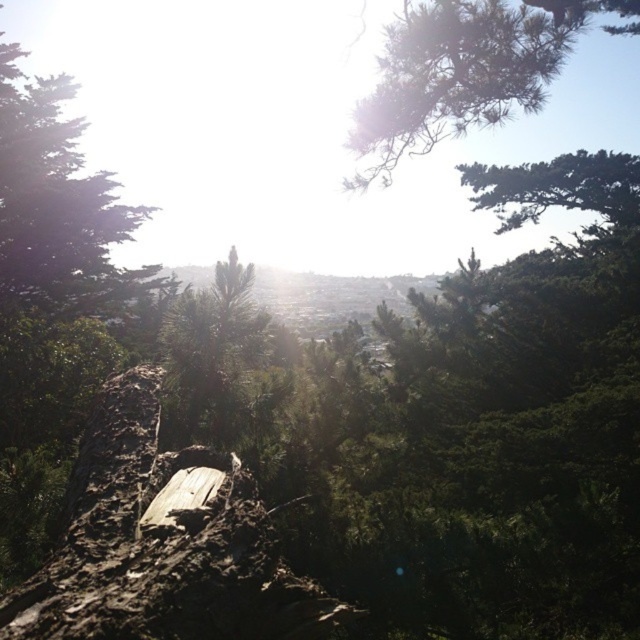
You are a hiker who wants to place a small backpack between the weathered wood log at center and the green textured pine branch at upper center. Based on their positions, where should you place it?

The weathered wood log at center is positioned under the green textured pine branch at upper center, so you should place the backpack between them below the green textured pine branch at upper center and above the weathered wood log at center.

You are an artist sketching this scene. You want to draw the green matte tree at upper left and the green textured pine branch at upper center. Which one should you draw first if you follow the layering shown in the image?

The green matte tree at upper left should be drawn first because it is positioned over the green textured pine branch at upper center, indicating it is closer and should be layered on top.